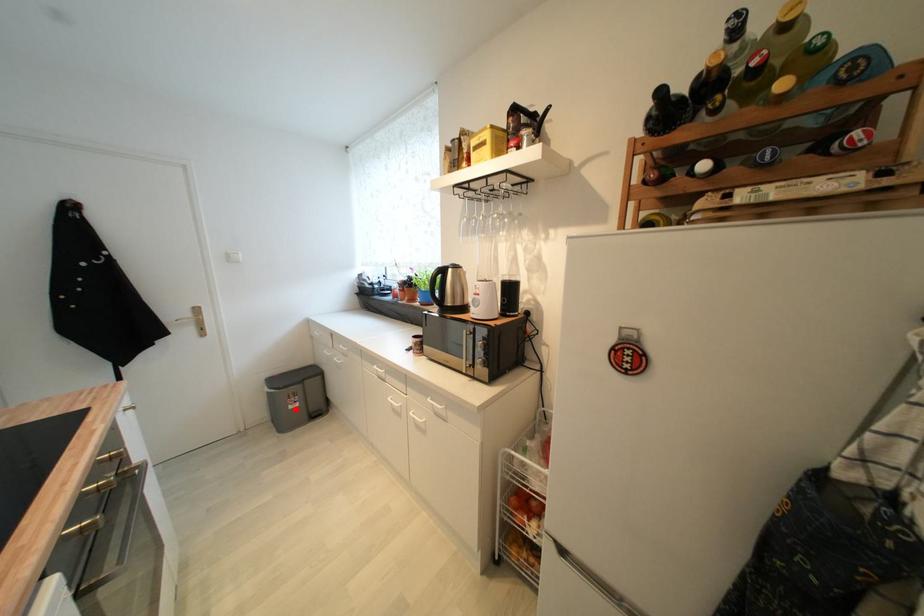
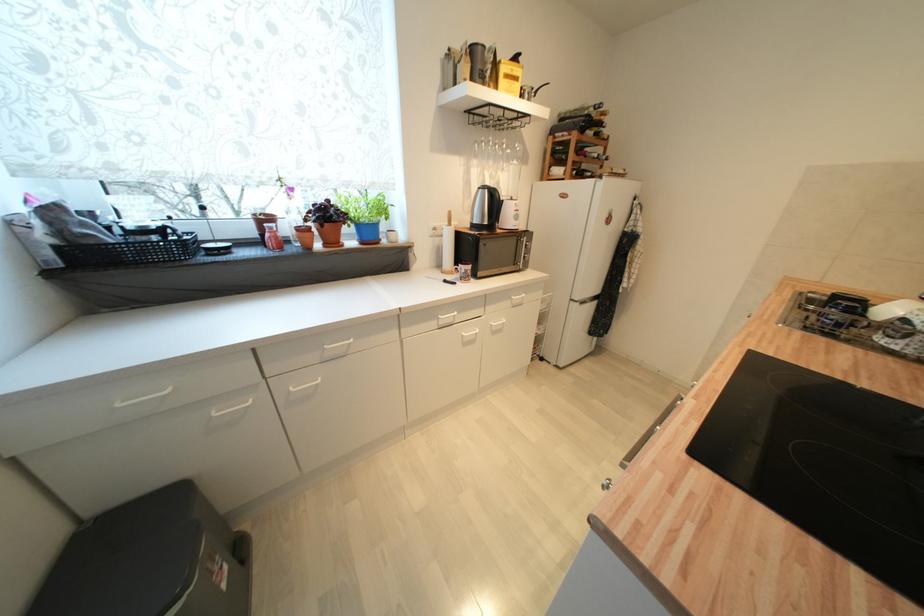
Question: I am providing you with two images of the same scene from different viewpoints. In image1, a red point is highlighted. Considering the same 3D point in image2, which of the following is correct?

Choices:
 (A) It is closer
 (B) It is farther

Answer: (B)